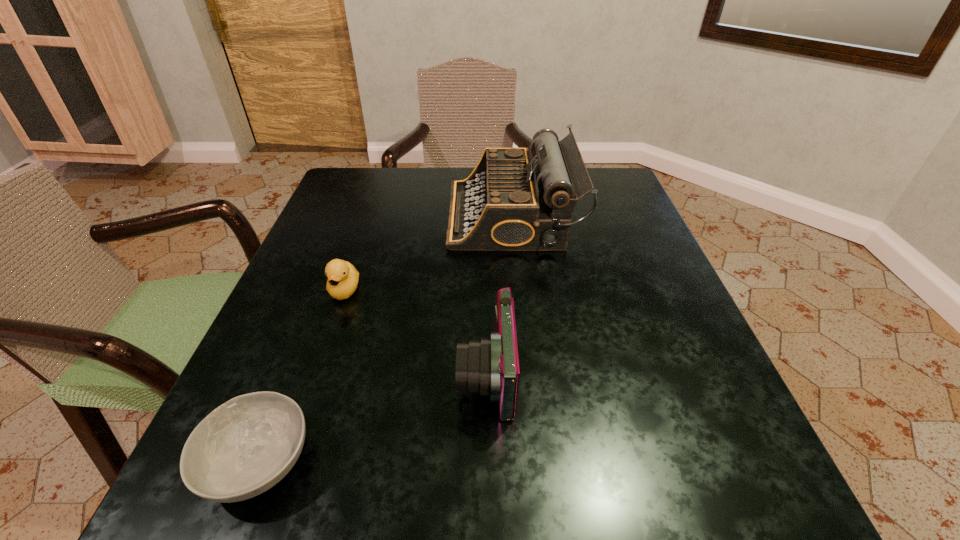
Find the location of a particular element. the farthest object is located at coordinates (510, 202).

Locate an element on the screen. The width and height of the screenshot is (960, 540). typewriter is located at coordinates (510, 202).

The width and height of the screenshot is (960, 540). I want to click on camera, so click(x=490, y=367).

This screenshot has height=540, width=960. Find the location of `duckling`. duckling is located at coordinates (342, 282).

I want to click on the third tallest object, so click(342, 282).

Where is `bowl`? This screenshot has height=540, width=960. bowl is located at coordinates (247, 445).

Image resolution: width=960 pixels, height=540 pixels. In order to click on vacant space located on the keyboard of the tallest object in this screenshot , I will do `click(362, 216)`.

What are the coordinates of `free spot located on the keyboard of the tallest object` in the screenshot? It's located at (319, 216).

Find the location of a particular element. The width and height of the screenshot is (960, 540). vacant space located 0.270m on the keyboard of the tallest object is located at coordinates (331, 216).

The image size is (960, 540). I want to click on free region located on the front-facing side of the third shortest object, so click(x=309, y=374).